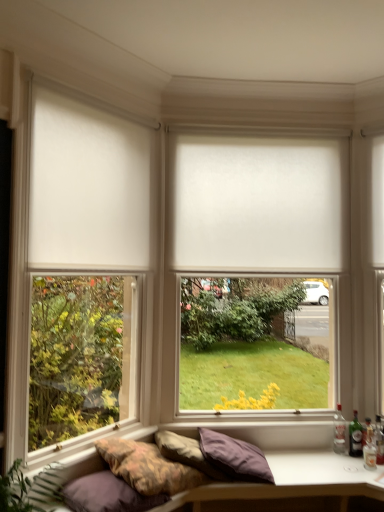
Question: In which direction should I rotate to look at textured fabric studio couch at lower center?

Choices:
 (A) right
 (B) left

Answer: (A)

Question: Considering the relative sizes of purple cotton pillow at lower left, the 1th pillow in the left-to-right sequence, and clear glass bottle at lower right, placed as the first bottle when sorted from left to right, in the image provided, is purple cotton pillow at lower left, the 1th pillow in the left-to-right sequence, wider than clear glass bottle at lower right, placed as the first bottle when sorted from left to right,?

Choices:
 (A) no
 (B) yes

Answer: (B)

Question: Considering the relative sizes of purple cotton pillow at lower left, which is the 3th pillow from right to left, and clear glass bottle at lower right, which is counted as the fourth bottle, starting from the right, in the image provided, is purple cotton pillow at lower left, which is the 3th pillow from right to left, smaller than clear glass bottle at lower right, which is counted as the fourth bottle, starting from the right,?

Choices:
 (A) no
 (B) yes

Answer: (A)

Question: Can you confirm if purple cotton pillow at lower left, the 1th pillow in the left-to-right sequence, is positioned to the right of clear glass bottle at lower right, placed as the first bottle when sorted from left to right?

Choices:
 (A) yes
 (B) no

Answer: (B)

Question: Can you confirm if purple cotton pillow at lower left, which is the 3th pillow from right to left, is bigger than clear glass bottle at lower right, placed as the first bottle when sorted from left to right?

Choices:
 (A) yes
 (B) no

Answer: (A)

Question: Could you tell me if purple cotton pillow at lower left, which is the 3th pillow from right to left, is turned towards clear glass bottle at lower right, placed as the first bottle when sorted from left to right?

Choices:
 (A) no
 (B) yes

Answer: (A)

Question: From a real-world perspective, is purple cotton pillow at lower left, the 1th pillow in the left-to-right sequence, under clear glass bottle at lower right, which is counted as the fourth bottle, starting from the right?

Choices:
 (A) no
 (B) yes

Answer: (B)

Question: Is purple fabric pillow at lower center, the second pillow in the left-to-right sequence, at the back of textured fabric studio couch at lower center?

Choices:
 (A) yes
 (B) no

Answer: (B)

Question: Is textured fabric studio couch at lower center further to the viewer compared to purple fabric pillow at lower center, the second pillow in the left-to-right sequence?

Choices:
 (A) yes
 (B) no

Answer: (B)

Question: Would you say purple fabric pillow at lower center, the second pillow in the right-to-left sequence, is part of textured fabric studio couch at lower center's contents?

Choices:
 (A) yes
 (B) no

Answer: (B)

Question: Does textured fabric studio couch at lower center turn towards purple fabric pillow at lower center, the second pillow in the right-to-left sequence?

Choices:
 (A) yes
 (B) no

Answer: (B)

Question: Considering the relative sizes of textured fabric studio couch at lower center and purple fabric pillow at lower center, the second pillow in the right-to-left sequence, in the image provided, is textured fabric studio couch at lower center smaller than purple fabric pillow at lower center, the second pillow in the right-to-left sequence,?

Choices:
 (A) yes
 (B) no

Answer: (B)

Question: Can you confirm if textured fabric studio couch at lower center is taller than purple fabric pillow at lower center, the second pillow in the left-to-right sequence?

Choices:
 (A) yes
 (B) no

Answer: (A)

Question: Does clear glass bottle at lower right, which is counted as the fourth bottle, starting from the right, have a greater height compared to white matte window frame at upper left?

Choices:
 (A) yes
 (B) no

Answer: (B)